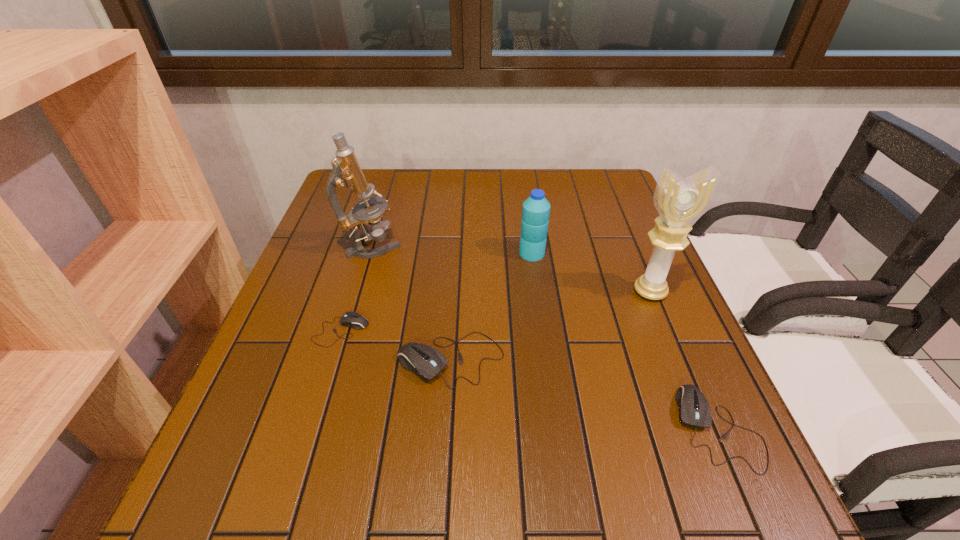
This screenshot has height=540, width=960. I want to click on free spot between the third farthest object and the fifth tallest object, so click(684, 360).

I want to click on empty space that is in between the award and the third object from left to right, so [x=550, y=326].

Where is `unoccupied area between the third farthest object and the shortest object`? The image size is (960, 540). unoccupied area between the third farthest object and the shortest object is located at coordinates (495, 311).

The image size is (960, 540). What are the coordinates of `vacant space in between the rightmost computer mouse and the second computer mouse from right to left` in the screenshot? It's located at (585, 394).

The image size is (960, 540). I want to click on free space between the second computer mouse from right to left and the shortest computer mouse, so click(396, 345).

This screenshot has width=960, height=540. Identify the location of vacant area between the microscope and the award. (512, 268).

At what (x,y) coordinates should I click in order to perform the action: click on free space between the fourth object from right to left and the third farthest object. Please return your answer as a coordinate pair (x, y). The image size is (960, 540). Looking at the image, I should click on (550, 326).

Identify which object is the closest to the shortest computer mouse. Please provide its 2D coordinates. Your answer should be formatted as a tuple, i.e. [(x, y)], where the tuple contains the x and y coordinates of a point satisfying the conditions above.

[(427, 362)]

The width and height of the screenshot is (960, 540). I want to click on object that is the second nearest to the fourth object from left to right, so click(427, 362).

Locate which computer mouse ranks second in proximity to the second computer mouse from right to left. Please provide its 2D coordinates. Your answer should be formatted as a tuple, i.e. [(x, y)], where the tuple contains the x and y coordinates of a point satisfying the conditions above.

[(694, 410)]